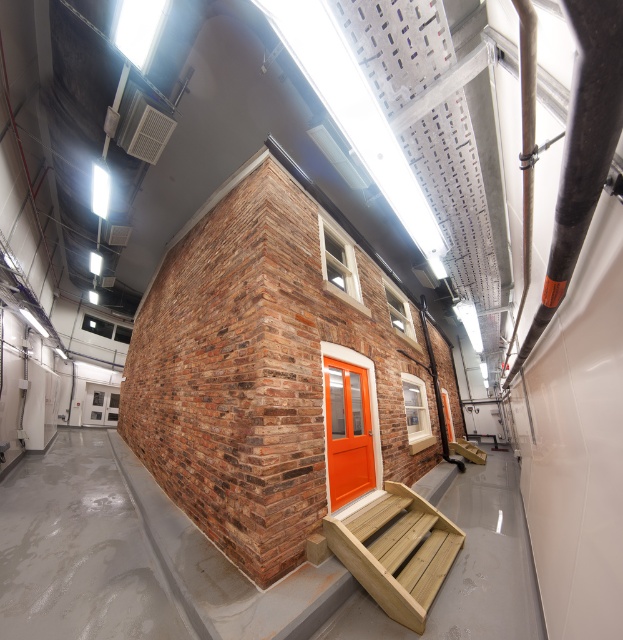
Question: Estimate the real-world distances between objects in this image. Which object is closer to the brown brick at center?

Choices:
 (A) orange glossy door at center
 (B) wooden bench at center

Answer: (B)

Question: Which point is closer to the camera taking this photo?

Choices:
 (A) (239, 458)
 (B) (434, 525)
 (C) (348, 476)
 (D) (457, 444)

Answer: (A)

Question: From the image, what is the correct spatial relationship of natural wood bench at lower center in relation to wooden bench at center?

Choices:
 (A) above
 (B) below

Answer: (A)

Question: Which object is farther from the camera taking this photo?

Choices:
 (A) orange glossy door at center
 (B) brown brick at center
 (C) natural wood bench at lower center
 (D) wooden bench at center

Answer: (D)

Question: Does brown brick at center appear on the left side of orange glossy door at center?

Choices:
 (A) yes
 (B) no

Answer: (B)

Question: Does brown brick at center appear under orange glossy door at center?

Choices:
 (A) yes
 (B) no

Answer: (A)